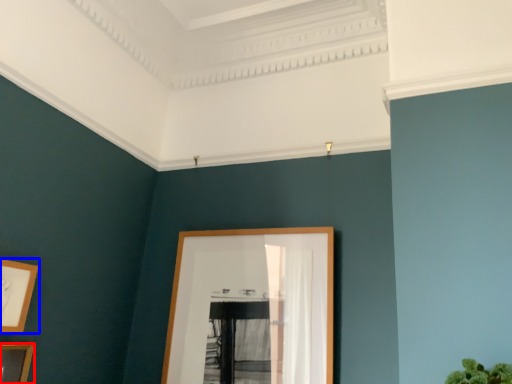
Question: Which object is further to the camera taking this photo, picture frame (highlighted by a red box) or picture frame (highlighted by a blue box)?

Choices:
 (A) picture frame
 (B) picture frame

Answer: (B)